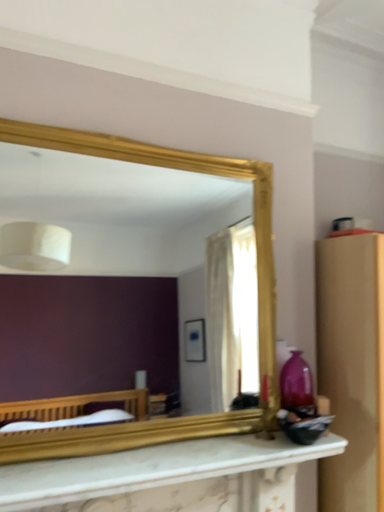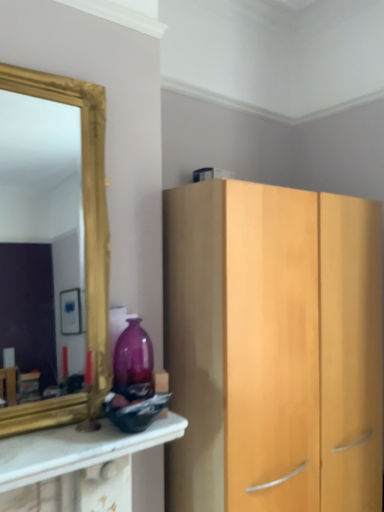
Question: How did the camera likely rotate when shooting the video?

Choices:
 (A) rotated left
 (B) rotated right

Answer: (B)